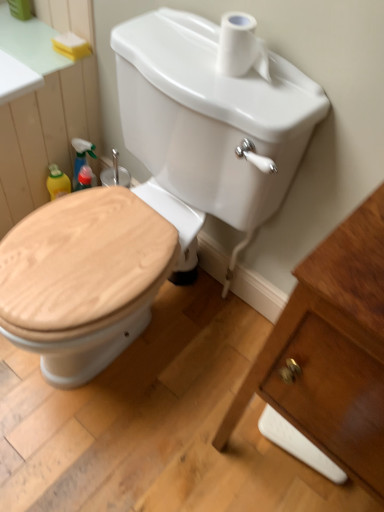
Where is `vacant area in front of white matte toilet paper at upper center`? This screenshot has width=384, height=512. vacant area in front of white matte toilet paper at upper center is located at coordinates (251, 92).